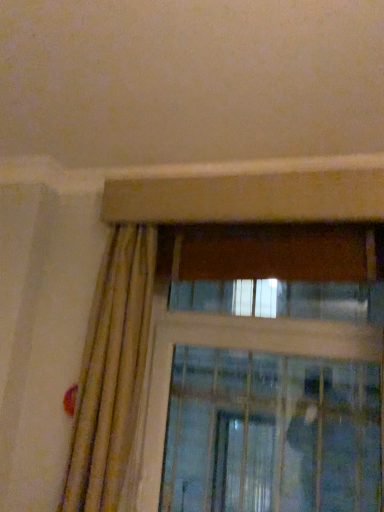
Question: From a real-world perspective, does clear glass screen door at upper center stand above beige textured curtain at left?

Choices:
 (A) no
 (B) yes

Answer: (A)

Question: Can you confirm if clear glass screen door at upper center is thinner than beige textured curtain at left?

Choices:
 (A) yes
 (B) no

Answer: (A)

Question: Is beige textured curtain at left located within clear glass screen door at upper center?

Choices:
 (A) yes
 (B) no

Answer: (B)

Question: Is clear glass screen door at upper center positioned with its back to beige textured curtain at left?

Choices:
 (A) yes
 (B) no

Answer: (B)

Question: Are clear glass screen door at upper center and beige textured curtain at left far apart?

Choices:
 (A) no
 (B) yes

Answer: (A)

Question: Does clear glass screen door at upper center have a lesser height compared to beige textured curtain at left?

Choices:
 (A) yes
 (B) no

Answer: (A)

Question: Can you confirm if beige textured curtain at left is positioned to the left of clear glass screen door at upper center?

Choices:
 (A) no
 (B) yes

Answer: (B)

Question: Is beige textured curtain at left aimed at clear glass screen door at upper center?

Choices:
 (A) yes
 (B) no

Answer: (B)

Question: Can clear glass screen door at upper center be found inside beige textured curtain at left?

Choices:
 (A) no
 (B) yes

Answer: (A)

Question: Is beige textured curtain at left looking in the opposite direction of clear glass screen door at upper center?

Choices:
 (A) yes
 (B) no

Answer: (B)

Question: Can you confirm if beige textured curtain at left is thinner than clear glass screen door at upper center?

Choices:
 (A) yes
 (B) no

Answer: (B)

Question: Can you confirm if beige textured curtain at left is shorter than clear glass screen door at upper center?

Choices:
 (A) yes
 (B) no

Answer: (B)

Question: In the image, is beige textured curtain at left positioned in front of or behind clear glass screen door at upper center?

Choices:
 (A) behind
 (B) front

Answer: (B)